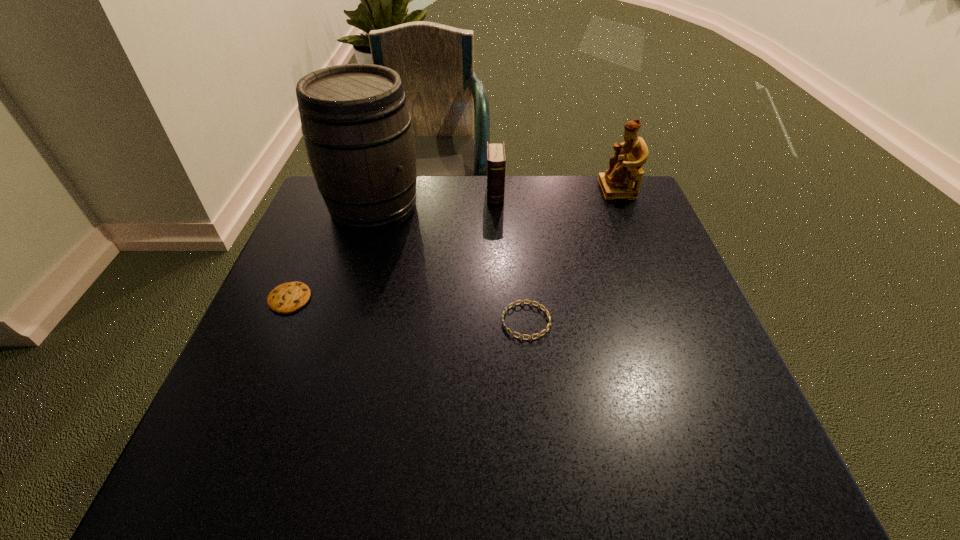
You are a GUI agent. You are given a task and a screenshot of the screen. Output one action in this format:
    pyautogui.click(x=<x>, y=<y>)
    Task: Click on the vacant space situated on the spine side of the diary
    The height and width of the screenshot is (540, 960).
    Given the screenshot: What is the action you would take?
    pyautogui.click(x=500, y=313)

Locate an element on the screen. The image size is (960, 540). vacant space located on the surface of the bracelet showing star-shaped elements is located at coordinates (428, 321).

This screenshot has height=540, width=960. I want to click on vacant space situated on the surface of the bracelet showing star-shaped elements, so click(468, 321).

The height and width of the screenshot is (540, 960). Find the location of `vacant area situated on the surface of the bracelet showing star-shaped elements`. vacant area situated on the surface of the bracelet showing star-shaped elements is located at coordinates (409, 321).

Locate an element on the screen. This screenshot has width=960, height=540. vacant space located 0.130m on the right of the cookie is located at coordinates (371, 299).

At what (x,y) coordinates should I click in order to perform the action: click on wine bucket at the far edge. Please return your answer as a coordinate pair (x, y). This screenshot has height=540, width=960. Looking at the image, I should click on (357, 130).

In order to click on figurine present at the far edge in this screenshot , I will do tap(618, 182).

In order to click on diary present at the far edge in this screenshot , I will do tap(496, 160).

Image resolution: width=960 pixels, height=540 pixels. Find the location of `wine bucket that is at the left edge`. wine bucket that is at the left edge is located at coordinates (357, 130).

Image resolution: width=960 pixels, height=540 pixels. In order to click on cookie that is at the left edge in this screenshot , I will do `click(286, 298)`.